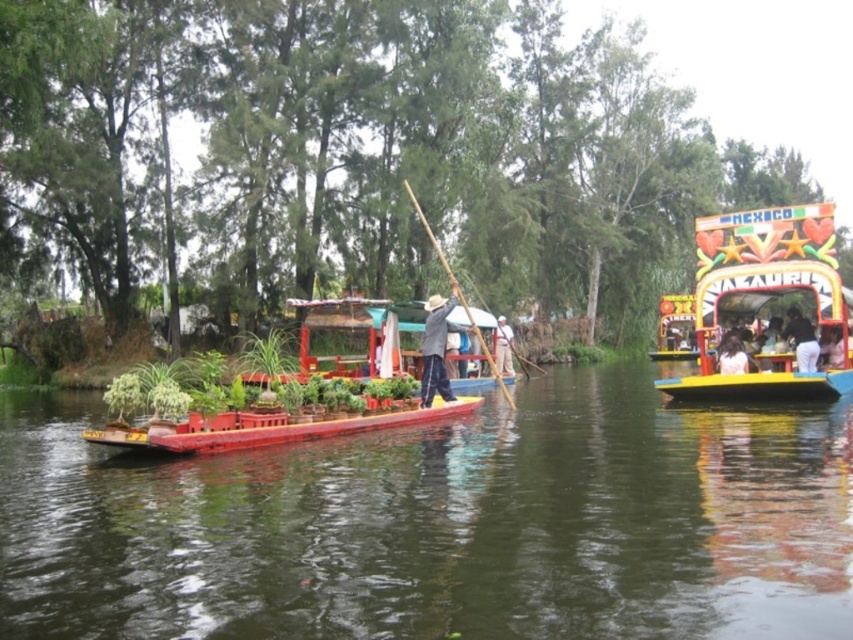
Question: Which point is farther to the camera?

Choices:
 (A) (686, 400)
 (B) (795, 356)
 (C) (204, 419)
 (D) (828, 339)

Answer: (A)

Question: Can you confirm if smooth yellow boat at center is bigger than light brown wooden boat at center?

Choices:
 (A) yes
 (B) no

Answer: (A)

Question: Which of the following is the farthest from the observer?

Choices:
 (A) (567, 524)
 (B) (444, 397)

Answer: (B)

Question: Is wooden boat at center behind light brown wooden boat at center?

Choices:
 (A) no
 (B) yes

Answer: (A)

Question: Which point is farther from the camera taking this photo?

Choices:
 (A) (498, 371)
 (B) (410, 417)
 (C) (840, 365)
 (D) (498, 352)

Answer: (D)

Question: Does gray fabric hat at center appear on the left side of smooth yellow boat at center?

Choices:
 (A) no
 (B) yes

Answer: (B)